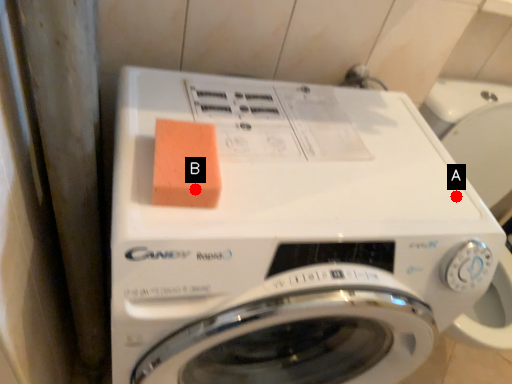
Question: Two points are circled on the image, labeled by A and B beside each circle. Among these points, which one is farthest from the camera?

Choices:
 (A) A is further
 (B) B is further

Answer: (A)